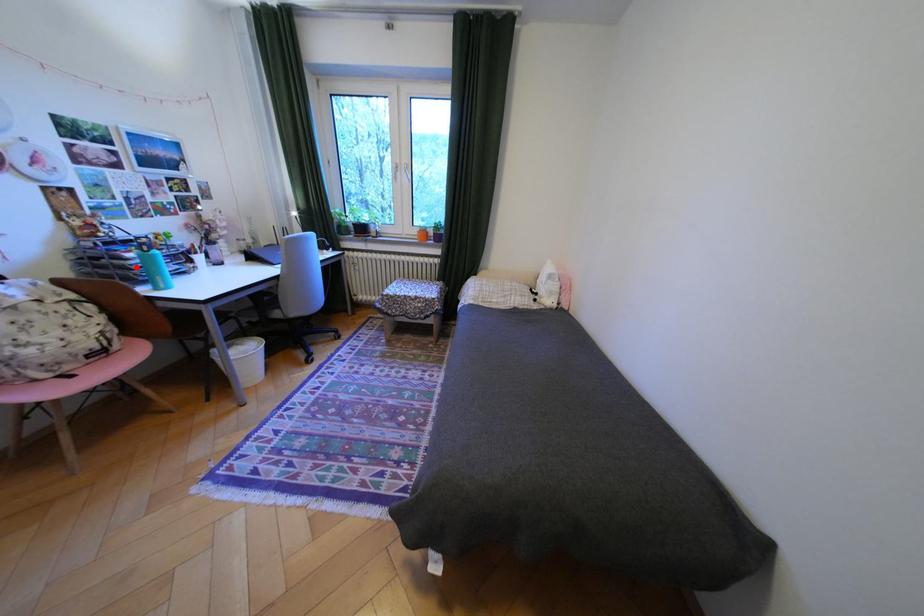
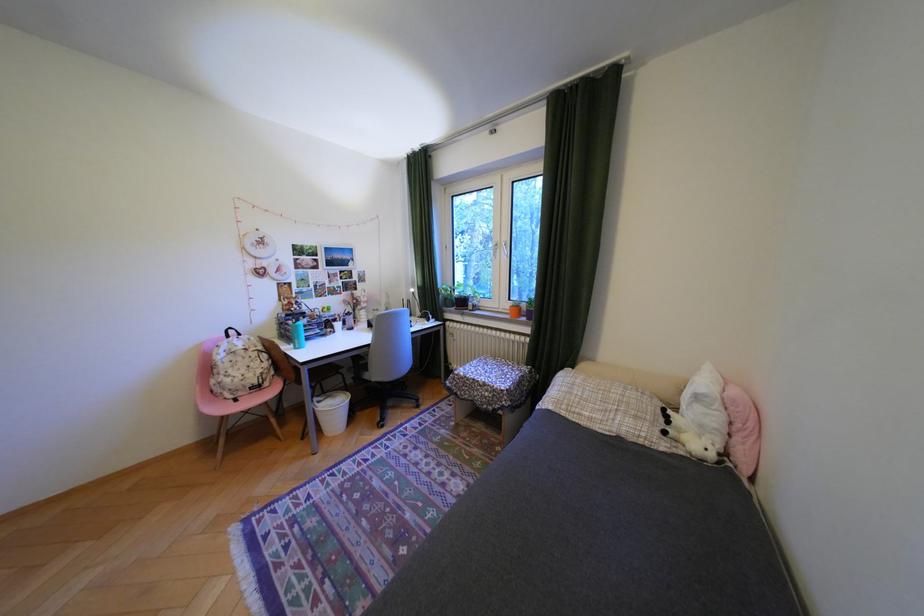
The point at the highlighted location is marked in the first image. Where is the corresponding point in the second image?

(300, 331)